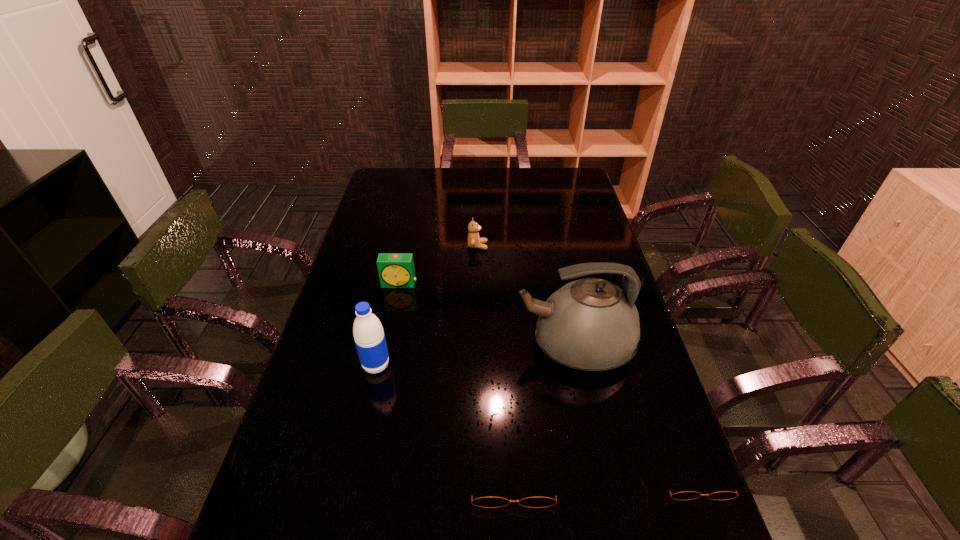
At what (x,y) coordinates should I click in order to perform the action: click on vacant space at the left edge. Please return your answer as a coordinate pair (x, y). Looking at the image, I should click on (348, 407).

This screenshot has width=960, height=540. I want to click on vacant space at the right edge of the desktop, so click(611, 254).

Where is `blank space at the far right corner`? The height and width of the screenshot is (540, 960). blank space at the far right corner is located at coordinates (567, 194).

Identify the location of vacant space at the near right corner. The image size is (960, 540). (673, 508).

Where is `vacant area between the shortest object and the water bottle`? Image resolution: width=960 pixels, height=540 pixels. vacant area between the shortest object and the water bottle is located at coordinates (535, 421).

The width and height of the screenshot is (960, 540). In order to click on unoccupied position between the tallest object and the taller sunglasses in this screenshot , I will do `click(543, 411)`.

I want to click on blank region between the fifth tallest object and the fifth nearest object, so click(456, 381).

The width and height of the screenshot is (960, 540). I want to click on vacant area that lies between the kettle and the alarm clock, so click(487, 314).

Where is `free space between the kettle and the water bottle`? The width and height of the screenshot is (960, 540). free space between the kettle and the water bottle is located at coordinates (475, 355).

You are a GUI agent. You are given a task and a screenshot of the screen. Output one action in this format:
    pyautogui.click(x=<x>, y=<y>)
    Task: Click on the vacant space that is in between the second farthest object and the shortest object
    The image size is (960, 540).
    Given the screenshot: What is the action you would take?
    pyautogui.click(x=546, y=380)